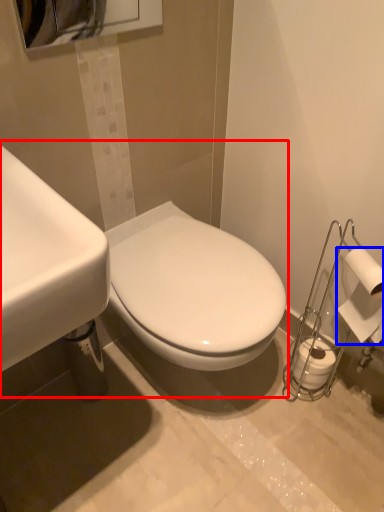
Question: Which object appears farthest to the camera in this image, sink (highlighted by a red box) or toilet paper (highlighted by a blue box)?

Choices:
 (A) sink
 (B) toilet paper

Answer: (B)